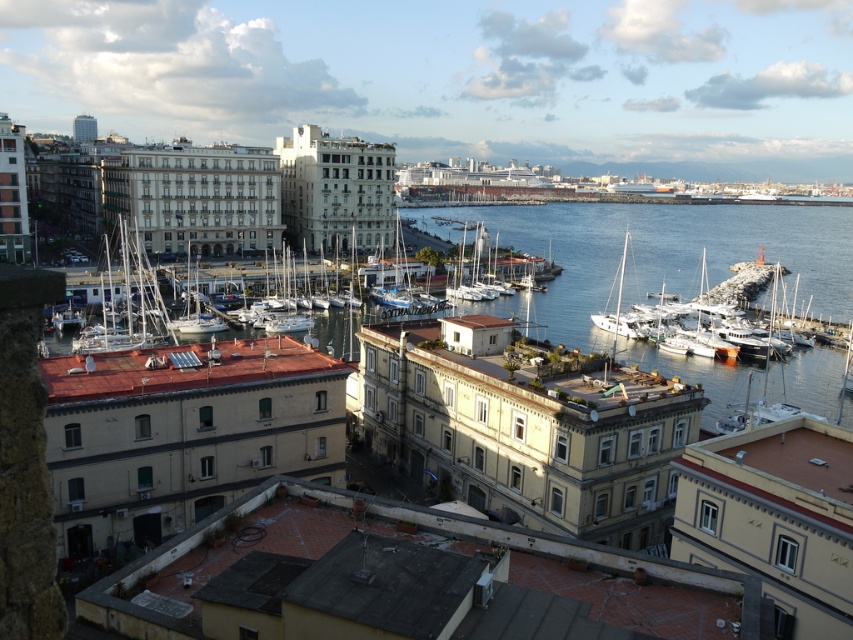
Consider the image. Does white matte boats at lower right have a smaller size compared to white glossy sailboat at center?

No, white matte boats at lower right is not smaller than white glossy sailboat at center.

Which of these two, white matte boats at lower right or white glossy sailboat at center, stands taller?

With more height is white matte boats at lower right.

This screenshot has height=640, width=853. What do you see at coordinates (697, 301) in the screenshot? I see `white matte boats at lower right` at bounding box center [697, 301].

The height and width of the screenshot is (640, 853). I want to click on white matte boats at lower right, so click(x=697, y=301).

Who is more distant from viewer, (625, 348) or (624, 243)?

Positioned behind is point (624, 243).

Can you confirm if clear blue water at center is positioned above white glossy sailboat at center?

Correct, clear blue water at center is located above white glossy sailboat at center.

What do you see at coordinates (677, 268) in the screenshot? The height and width of the screenshot is (640, 853). I see `clear blue water at center` at bounding box center [677, 268].

Find the location of a particular element. This screenshot has height=640, width=853. clear blue water at center is located at coordinates 677,268.

Which is above, clear blue water at center or white matte sailboat at center-left?

clear blue water at center

Which is behind, point (590, 346) or point (192, 326)?

The point (590, 346) is more distant.

Locate an element on the screen. The width and height of the screenshot is (853, 640). clear blue water at center is located at coordinates (677, 268).